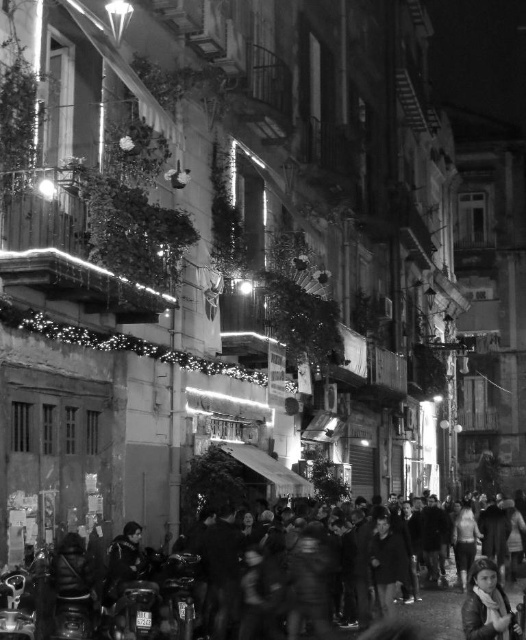
You are a photographer standing in the middle of the street. You notice a person with light brown hair at lower right and another wearing a dark textured coat at lower left. Which object is closer to you?

The light brown hair at lower right is closer to you because the dark textured coat at lower left is behind it.

Looking at this image, in the night scene with festive decorations, there are two people visible. One has light brown hair at lower right and another wearing a dark textured coat at lower left. Which person has a thinner feature between their hair and coat?

The light brown hair at lower right is thinner than the dark textured coat at lower left.